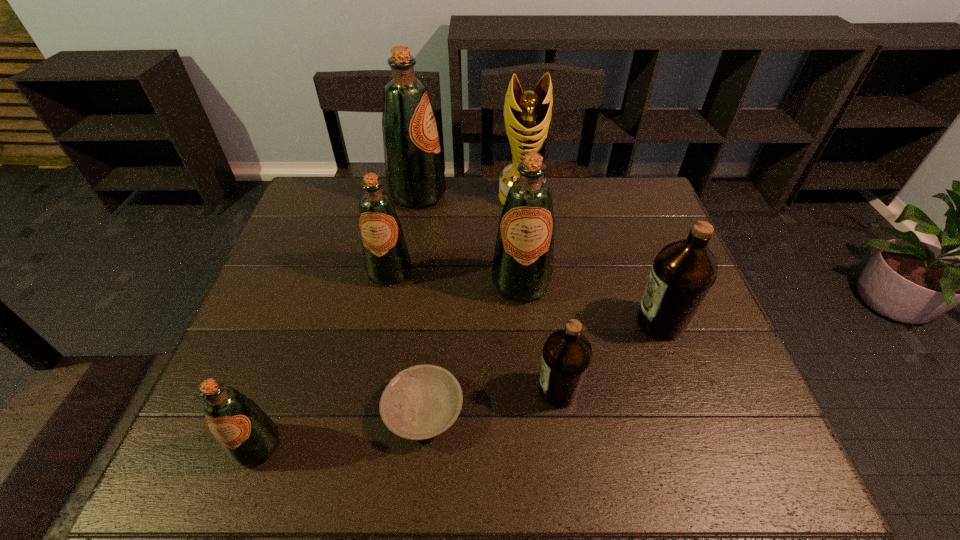
Locate an element on the screen. The width and height of the screenshot is (960, 540). the leftmost green olive oil is located at coordinates (x=248, y=436).

The image size is (960, 540). I want to click on the nearest olive oil, so click(x=248, y=436).

At what (x,y) coordinates should I click in order to perform the action: click on bowl. Please return your answer as a coordinate pair (x, y). This screenshot has width=960, height=540. Looking at the image, I should click on (421, 402).

Locate an element on the screen. free spot located 0.130m on the front-facing side of the farthest olive oil is located at coordinates (487, 195).

You are a GUI agent. You are given a task and a screenshot of the screen. Output one action in this format:
    pyautogui.click(x=<x>, y=<y>)
    Task: Click on the blank area located on the front-facing side of the award
    
    Given the screenshot: What is the action you would take?
    pyautogui.click(x=525, y=234)

Image resolution: width=960 pixels, height=540 pixels. I want to click on vacant region located 0.180m on the front-facing side of the rightmost green olive oil, so pos(529,368).

The width and height of the screenshot is (960, 540). What are the coordinates of `free space located on the front-facing side of the second smallest green olive oil` in the screenshot? It's located at (375, 342).

Identify the location of free spot located 0.170m on the label of the right brown olive oil. The image size is (960, 540). (564, 322).

At what (x,y) coordinates should I click in order to perform the action: click on vacant space located 0.330m on the label of the right brown olive oil. Please return your answer as a coordinate pair (x, y). Looking at the image, I should click on tap(498, 322).

Where is `free region located on the label of the right brown olive oil`? The width and height of the screenshot is (960, 540). free region located on the label of the right brown olive oil is located at coordinates (482, 322).